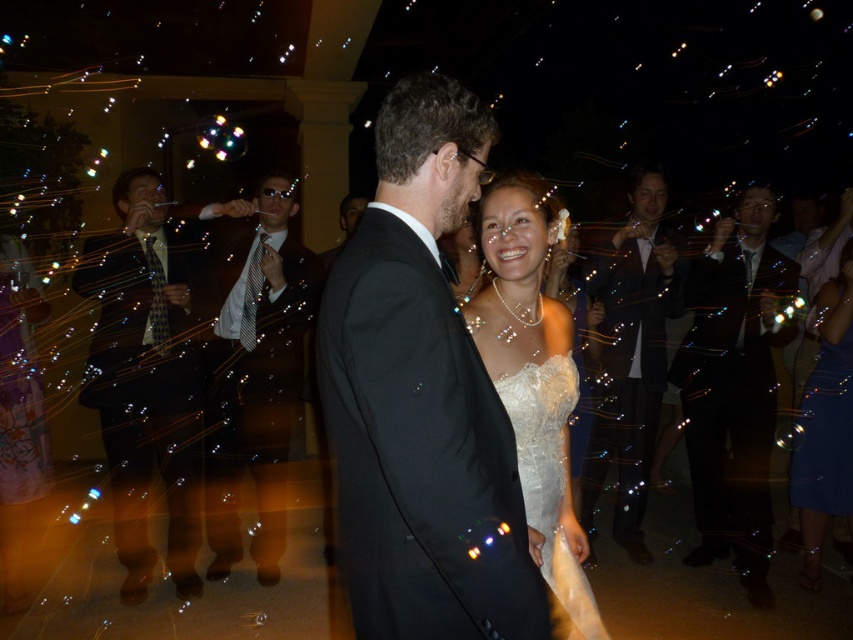
You are a photographer at the wedding and want to take a photo of the shiny black suit at right and the white lace dress at center. Which one will appear taller in the photo?

The shiny black suit at right will appear taller in the photo because it is much taller than the white lace dress at center.

You are a photographer at the wedding and need to capture a group photo. You have to position yourself so that both the black satin suit at center and the shiny black suit at right are fully visible in the frame. Which of the two suits requires you to adjust your camera angle more to ensure it fits into the shot?

The shiny black suit at right requires more adjustment because it occupies more space than the black satin suit at center, so the photographer needs to widen the camera angle or move back to include the entire shiny black suit at right in the frame.